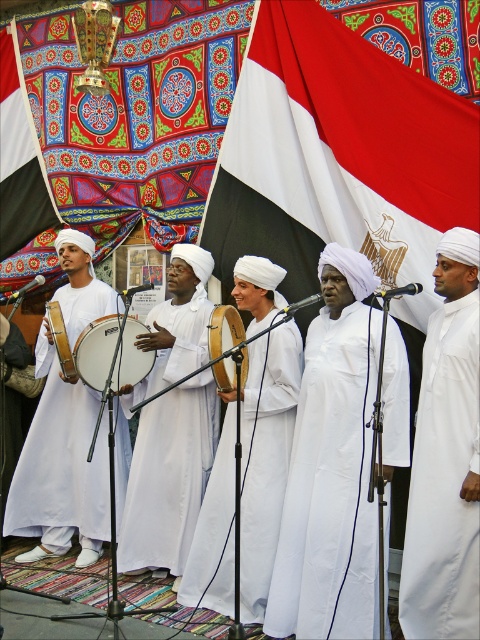
Question: Which object appears farthest from the camera in this image?

Choices:
 (A) wooden drum at center
 (B) white drum at center
 (C) white matte robe at right

Answer: (B)

Question: Does white fabric flag at upper left appear under wooden drum at left?

Choices:
 (A) yes
 (B) no

Answer: (B)

Question: Is white matte robe at right closer to the viewer compared to white matte/soft robe at center?

Choices:
 (A) no
 (B) yes

Answer: (B)

Question: Which point appears closest to the camera in this image?

Choices:
 (A) (121, 384)
 (B) (76, 512)

Answer: (A)

Question: Which point is closer to the camera taking this photo?

Choices:
 (A) (463, 470)
 (B) (63, 378)
 (C) (383, 580)

Answer: (C)

Question: Does white smooth robe at center have a larger size compared to wooden drum at center?

Choices:
 (A) no
 (B) yes

Answer: (B)